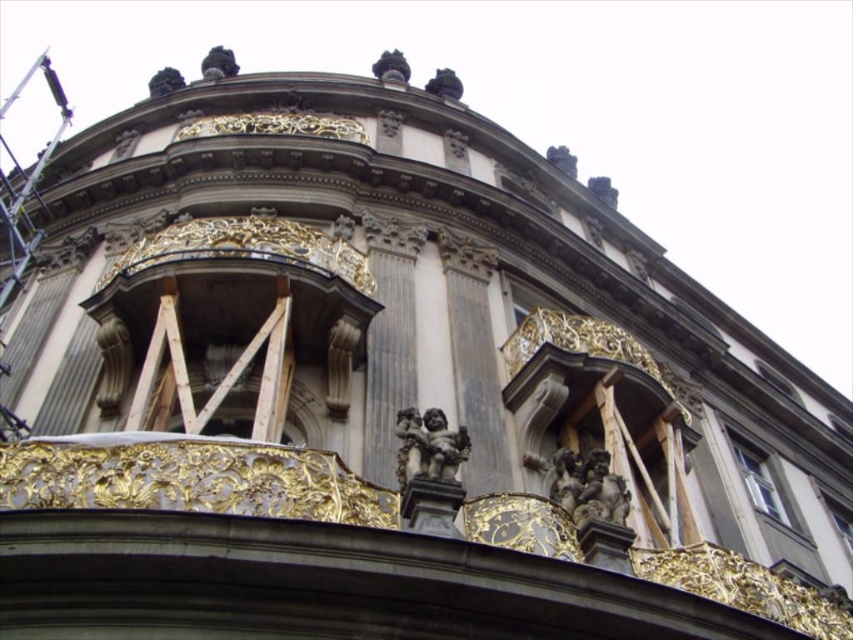
Is point (612, 472) positioned behind point (431, 461)?

Yes, point (612, 472) is farther from viewer.

Based on the photo, is gray stone cherubim at center above polished bronze cherub at center?

Actually, gray stone cherubim at center is below polished bronze cherub at center.

What do you see at coordinates (587, 486) in the screenshot?
I see `gray stone cherubim at center` at bounding box center [587, 486].

Locate an element on the screen. gray stone cherubim at center is located at coordinates (587, 486).